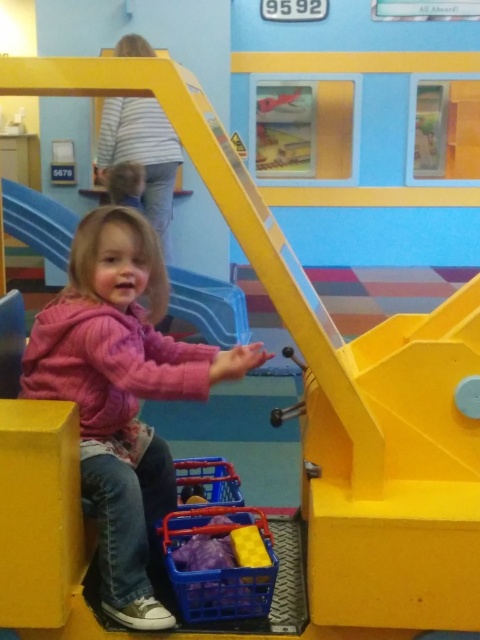
In the scene shown: Does pink fleece jacket at lower left lie behind yellow plastic slide at center?

That is False.

Does point (83, 476) come farther from viewer compared to point (55, 209)?

No.

Measure the distance between point (137, 513) and camera.

→ The distance of point (137, 513) from camera is 5.46 feet.

You are a GUI agent. You are given a task and a screenshot of the screen. Output one action in this format:
    pyautogui.click(x=<x>, y=<y>)
    Task: Click on the pink fleece jacket at lower left
    
    Given the screenshot: What is the action you would take?
    pyautogui.click(x=121, y=394)

Between yellow plastic slide at center and blonde hair at upper center, which one appears on the left side from the viewer's perspective?

From the viewer's perspective, blonde hair at upper center appears more on the left side.

Can you confirm if yellow plastic slide at center is positioned to the right of blonde hair at upper center?

Yes, yellow plastic slide at center is to the right of blonde hair at upper center.

Is point (222, 289) positioned in front of point (129, 196)?

No, it is not.

At what (x,y) coordinates should I click in order to perform the action: click on yellow plastic slide at center. Please return your answer as a coordinate pair (x, y). Looking at the image, I should click on (210, 307).

Does blue plastic crate at lower center appear under blonde hair at upper center?

Yes.

Who is positioned more to the left, blue plastic crate at lower center or blonde hair at upper center?

From the viewer's perspective, blonde hair at upper center appears more on the left side.

Where is `blue plastic crate at lower center`? blue plastic crate at lower center is located at coordinates (217, 566).

You are a GUI agent. You are given a task and a screenshot of the screen. Output one action in this format:
    pyautogui.click(x=<x>, y=<y>)
    Task: Click on the blue plastic crate at lower center
    The width and height of the screenshot is (480, 640).
    Given the screenshot: What is the action you would take?
    pyautogui.click(x=217, y=566)